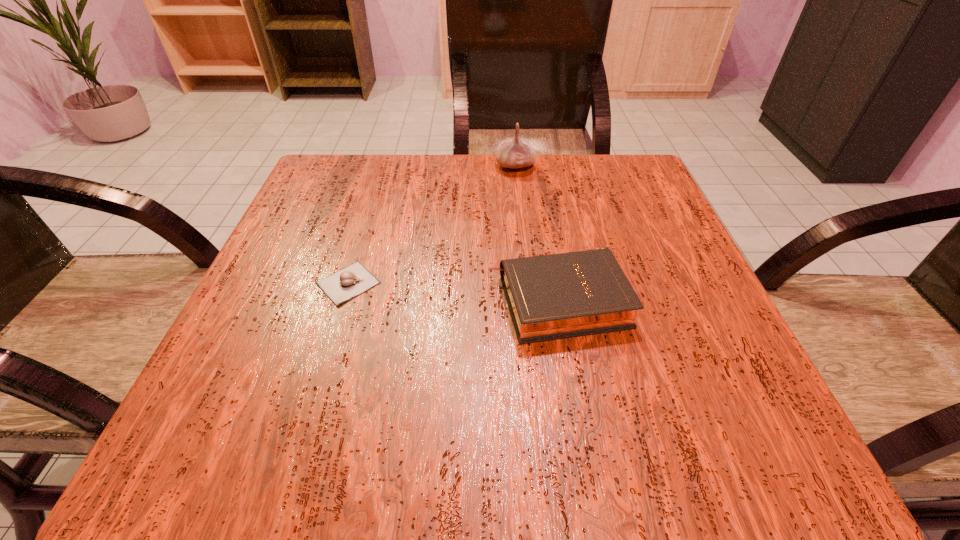
At what (x,y) coordinates should I click in order to perform the action: click on vacant space in between the tallest object and the second shortest object. Please return your answer as a coordinate pair (x, y). The width and height of the screenshot is (960, 540). Looking at the image, I should click on (537, 233).

Find the location of `vacant space in between the second shortest object and the tallest object`. vacant space in between the second shortest object and the tallest object is located at coordinates (537, 233).

This screenshot has height=540, width=960. Find the location of `free point between the Bible and the tallest object`. free point between the Bible and the tallest object is located at coordinates (537, 233).

Image resolution: width=960 pixels, height=540 pixels. Find the location of `vacant region between the second tallest object and the taller garlic`. vacant region between the second tallest object and the taller garlic is located at coordinates (537, 233).

I want to click on empty space that is in between the left garlic and the taller garlic, so point(432,224).

At what (x,y) coordinates should I click in order to perform the action: click on free space that is in between the farther garlic and the second tallest object. Please return your answer as a coordinate pair (x, y). The image size is (960, 540). Looking at the image, I should click on pyautogui.click(x=537, y=233).

Locate an element on the screen. free space that is in between the Bible and the left garlic is located at coordinates (453, 292).

The height and width of the screenshot is (540, 960). I want to click on free space between the tallest object and the shortest object, so click(x=432, y=224).

Find the location of a particular element. This screenshot has width=960, height=540. vacant area that lies between the shortest object and the farthest object is located at coordinates (432, 224).

Identify which object is the closest to the shorter garlic. Please provide its 2D coordinates. Your answer should be formatted as a tuple, i.e. [(x, y)], where the tuple contains the x and y coordinates of a point satisfying the conditions above.

[(555, 296)]